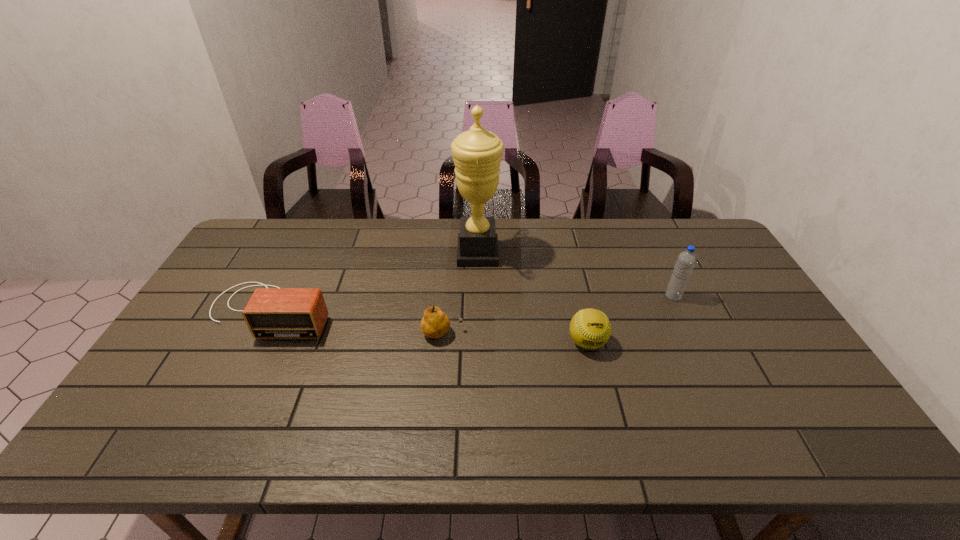
Locate an element on the screen. The image size is (960, 540). trophy cup is located at coordinates (477, 153).

Locate an element on the screen. The height and width of the screenshot is (540, 960). the farthest object is located at coordinates (477, 153).

Where is `the rightmost object`? The height and width of the screenshot is (540, 960). the rightmost object is located at coordinates (686, 261).

The height and width of the screenshot is (540, 960). Identify the location of the second tallest object. (686, 261).

Where is `the leftmost object`? This screenshot has width=960, height=540. the leftmost object is located at coordinates (277, 313).

Locate an element on the screen. The height and width of the screenshot is (540, 960). softball is located at coordinates (590, 328).

This screenshot has height=540, width=960. Find the location of `pear`. pear is located at coordinates (435, 323).

I want to click on free spot located at the front of the tallest object with handles, so click(x=532, y=253).

Locate an element on the screen. The image size is (960, 540). vacant space located on the back of the rightmost object is located at coordinates (642, 232).

Find the location of a particular element. free spot located 0.150m on the front-facing side of the leftmost object is located at coordinates (232, 387).